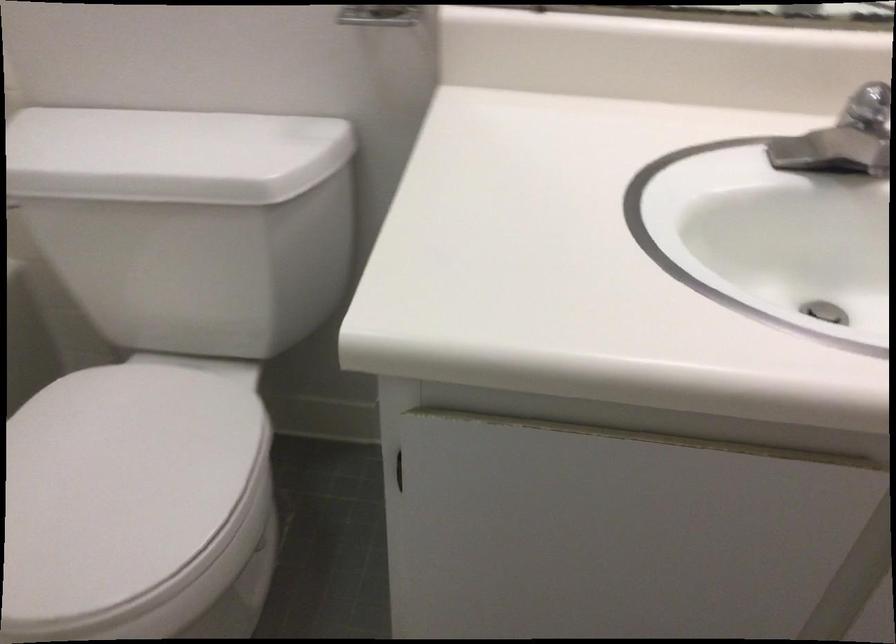
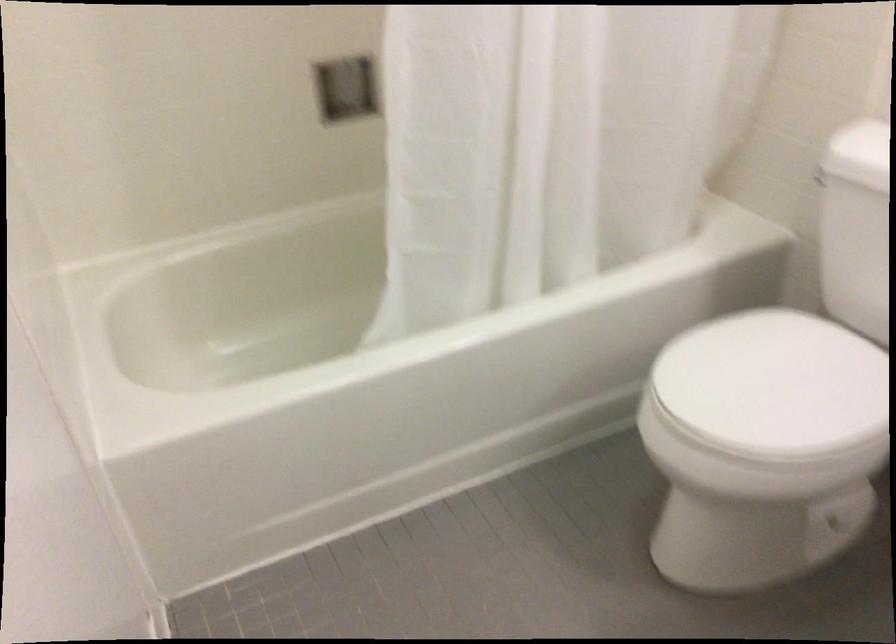
Find the pixel in the second image that matches point (118, 489) in the first image.

(773, 384)